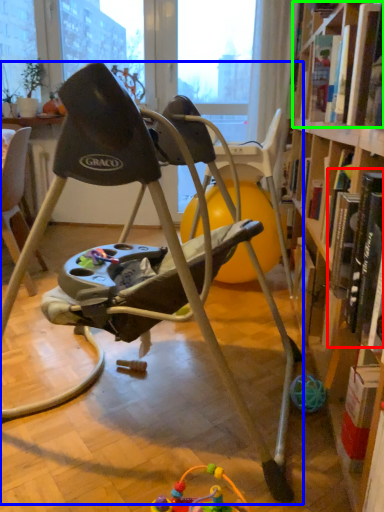
Question: Which is nearer to the book (highlighted by a red box)? chair (highlighted by a blue box) or book (highlighted by a green box).

Choices:
 (A) chair
 (B) book

Answer: (A)